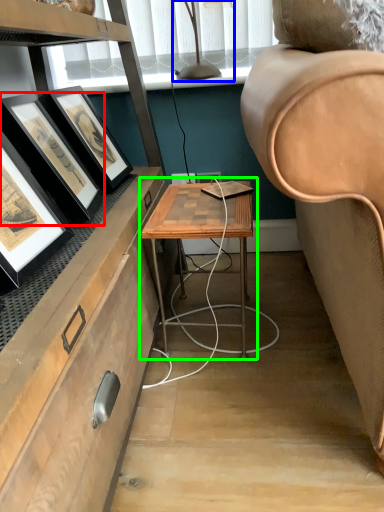
Question: Estimate the real-world distances between objects in this image. Which object is farther from picture frame (highlighted by a red box), table lamp (highlighted by a blue box) or table (highlighted by a green box)?

Choices:
 (A) table lamp
 (B) table

Answer: (A)